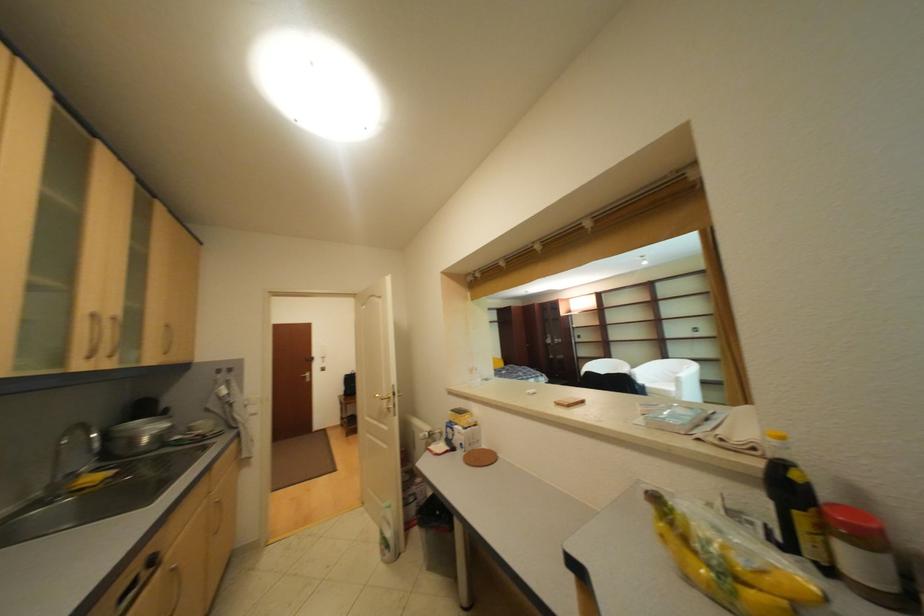
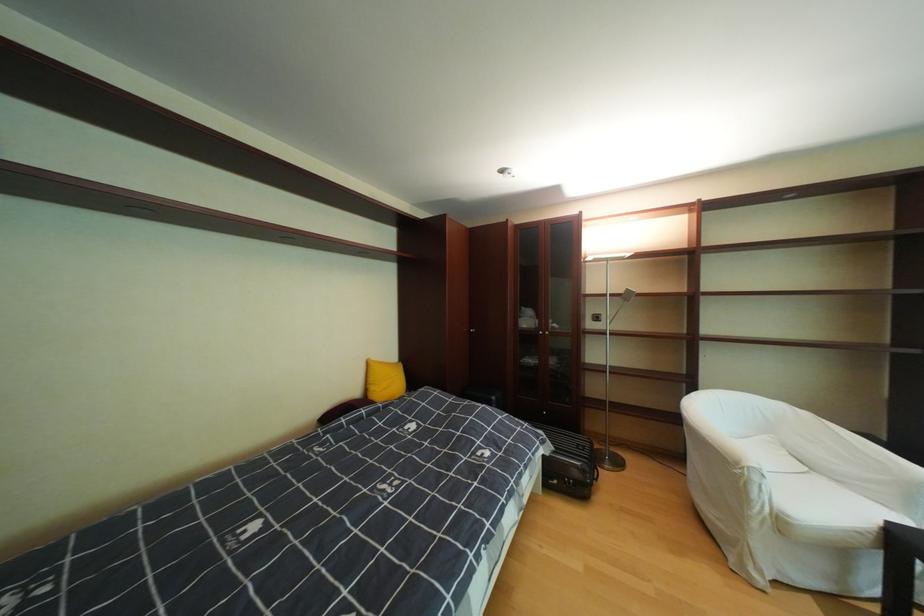
Find the pixel in the second image that matches the point at 634,363 in the first image.

(793, 407)